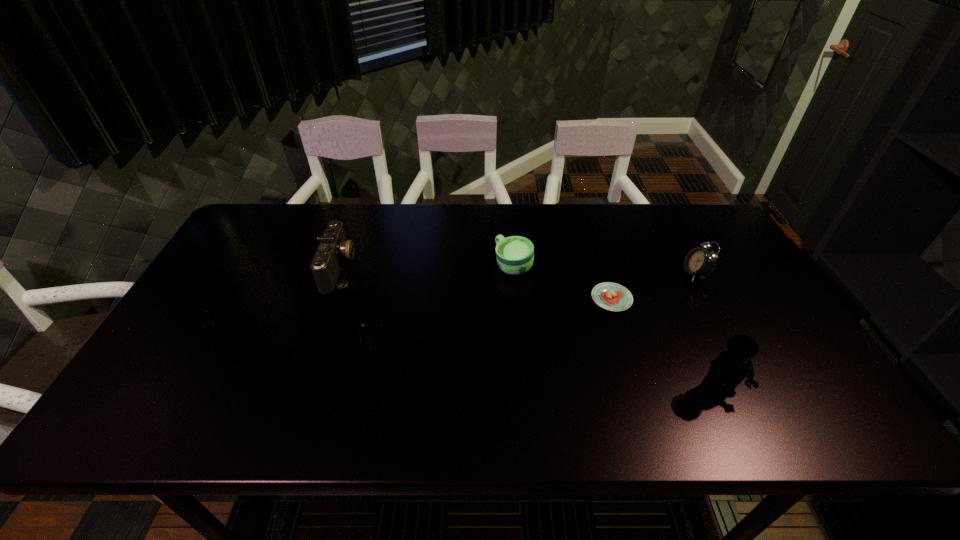
You are a GUI agent. You are given a task and a screenshot of the screen. Output one action in this format:
    pyautogui.click(x=<x>, y=<y>)
    Task: Click on the shortest Lego
    This screenshot has height=540, width=960.
    Given the screenshot: What is the action you would take?
    pyautogui.click(x=212, y=318)

Locate an element on the screen. the leftmost object is located at coordinates (212, 318).

Locate an element on the screen. This screenshot has height=540, width=960. the second Lego from right to left is located at coordinates (360, 314).

This screenshot has width=960, height=540. Find the location of `the second tallest object`. the second tallest object is located at coordinates click(x=360, y=314).

Where is `the nearest object`? the nearest object is located at coordinates (731, 367).

This screenshot has height=540, width=960. Identify the location of the nearest Lego. coord(731,367).

I want to click on camera, so click(327, 263).

This screenshot has height=540, width=960. Find the location of `the rightmost object`. the rightmost object is located at coordinates (699, 262).

Image resolution: width=960 pixels, height=540 pixels. I want to click on the fourth object from left to right, so click(x=515, y=254).

Find the location of `the sixth tallest object`. the sixth tallest object is located at coordinates (515, 254).